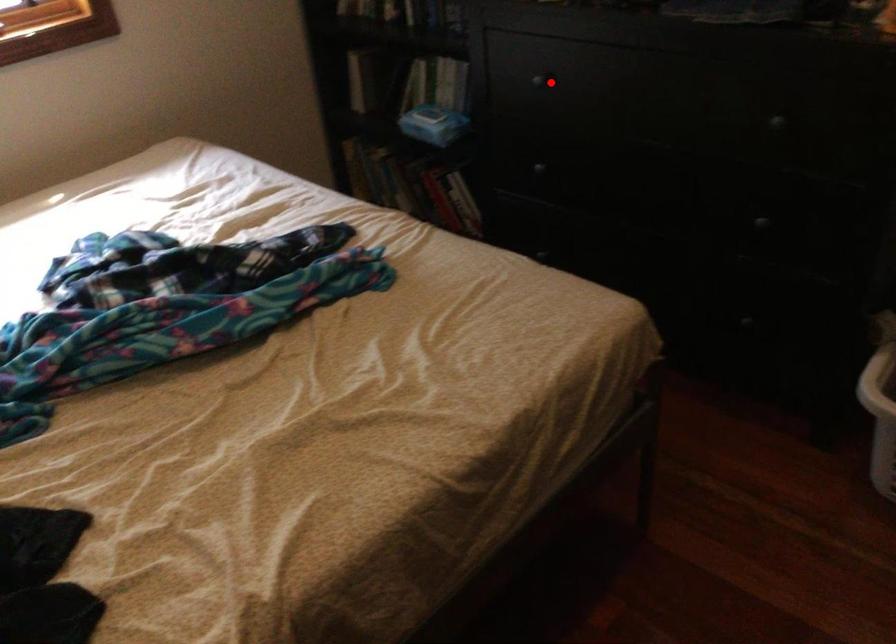
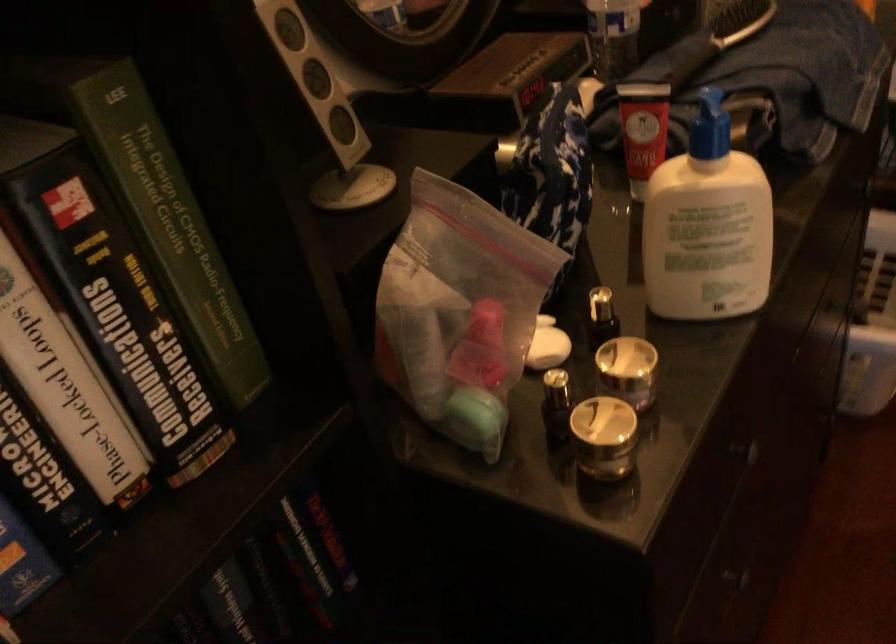
Question: I am providing you with two images of the same scene from different viewpoints. Given a red point in image1, look at the same physical point in image2. Is it:

Choices:
 (A) Closer to the viewpoint
 (B) Farther from the viewpoint

Answer: (A)